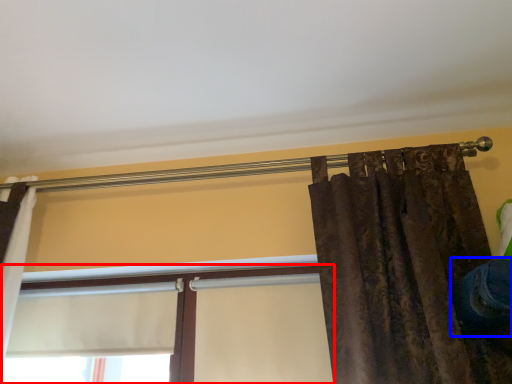
Question: Which object appears closest to the camera in this image, window (highlighted by a red box) or jeans (highlighted by a blue box)?

Choices:
 (A) window
 (B) jeans

Answer: (B)